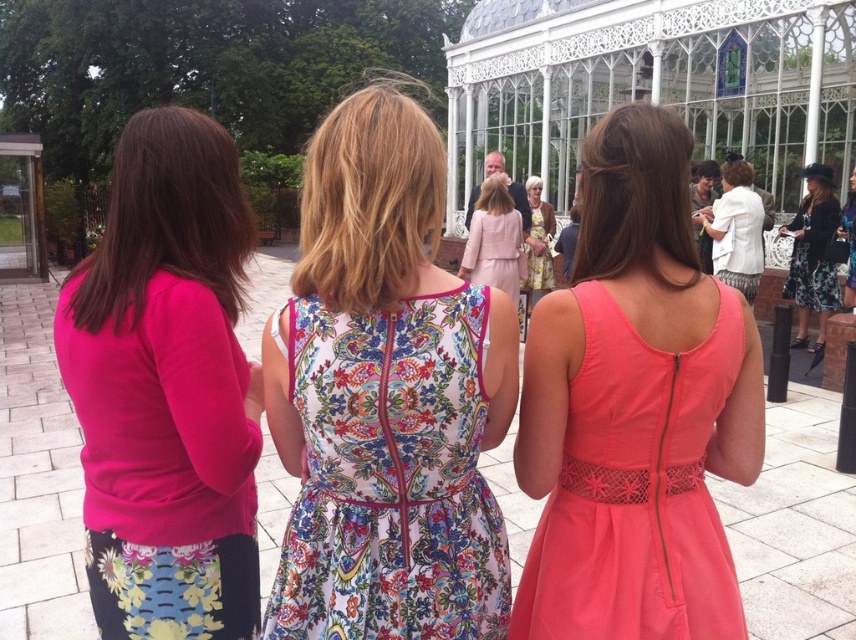
Does matte pink sweater at left have a lesser width compared to matte pink dress at center?

In fact, matte pink sweater at left might be wider than matte pink dress at center.

Can you confirm if matte pink sweater at left is positioned above matte pink dress at center?

No, matte pink sweater at left is not above matte pink dress at center.

Which is in front, point (123, 541) or point (474, 228)?

Point (123, 541)

Where is `matte pink sweater at left`? matte pink sweater at left is located at coordinates click(x=165, y=388).

Is white textured dress at right to the right of matte pink dress at center from the viewer's perspective?

A: Correct, you'll find white textured dress at right to the right of matte pink dress at center.

Between point (745, 166) and point (482, 184), which one is positioned behind?

Point (482, 184)

This screenshot has height=640, width=856. I want to click on white textured dress at right, so click(x=735, y=228).

Is floral-patterned fabric dress at center to the right of coral satin dress at center from the viewer's perspective?

Incorrect, floral-patterned fabric dress at center is not on the right side of coral satin dress at center.

Does floral-patterned fabric dress at center have a lesser width compared to coral satin dress at center?

No.

The image size is (856, 640). What are the coordinates of `floral-patterned fabric dress at center` in the screenshot? It's located at (390, 476).